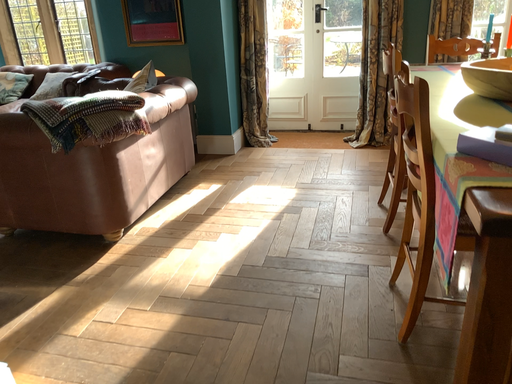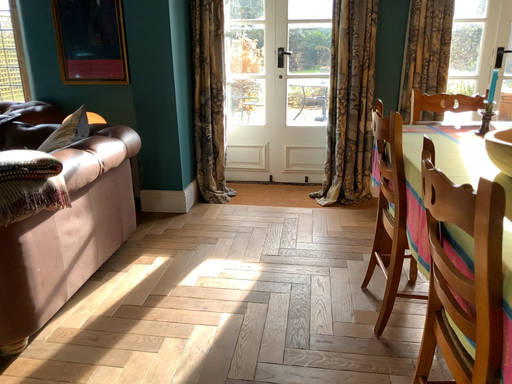
Question: Which way did the camera rotate in the video?

Choices:
 (A) rotated right
 (B) rotated left

Answer: (A)